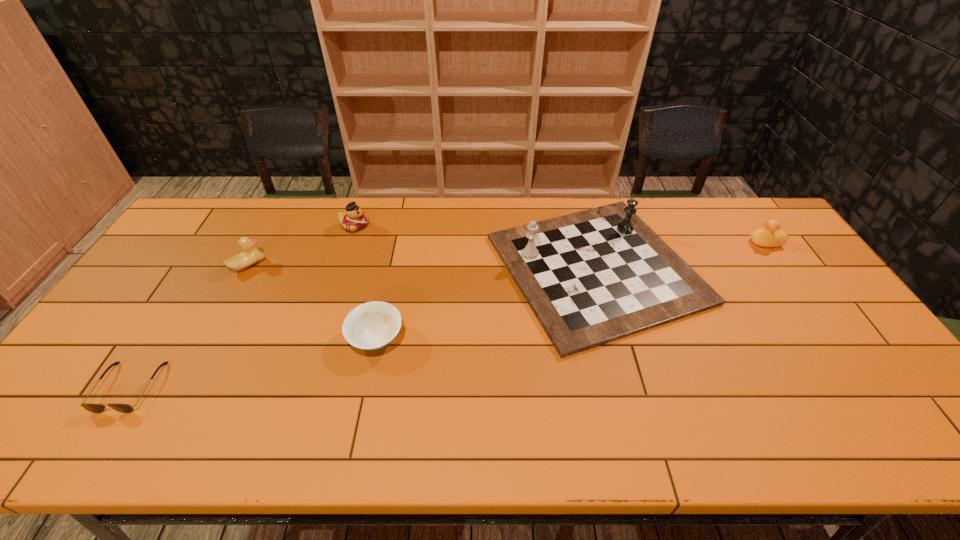
I want to click on free region that satisfies the following two spatial constraints: 1. on the face of the rightmost duck; 2. on the front-facing side of the shortest object, so click(866, 387).

Identify the location of vacant region that satisfies the following two spatial constraints: 1. at the beak of the second object from left to right; 2. on the front-facing side of the leftmost object. (182, 387).

Find the location of a particular element. free space that satisfies the following two spatial constraints: 1. on the back side of the gameboard; 2. on the face of the second duck from left to right is located at coordinates (585, 226).

You are a GUI agent. You are given a task and a screenshot of the screen. Output one action in this format:
    pyautogui.click(x=<x>, y=<y>)
    Task: Click on the vacant space that satisfies the following two spatial constraints: 1. on the face of the second farthest duck; 2. on the front-facing side of the nearest object
    The image size is (960, 540).
    Given the screenshot: What is the action you would take?
    pyautogui.click(x=866, y=387)

I want to click on vacant space that satisfies the following two spatial constraints: 1. at the beak of the bowl; 2. on the right side of the second object from left to right, so click(208, 338).